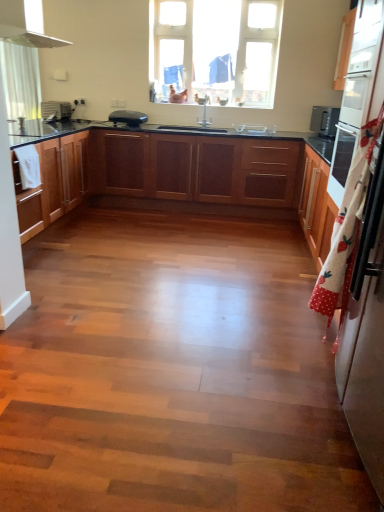
This screenshot has height=512, width=384. What do you see at coordinates (365, 355) in the screenshot? I see `white glossy refrigerator at right` at bounding box center [365, 355].

The image size is (384, 512). What do you see at coordinates (255, 129) in the screenshot? I see `white glossy sink at center` at bounding box center [255, 129].

Describe the element at coordinates (346, 229) in the screenshot. I see `white polka dot fabric at right` at that location.

What are the coordinates of `wooden cabinets at center, which is the third cabinetry in front-to-back order` in the screenshot? It's located at (194, 168).

The image size is (384, 512). What are the coordinates of `wooden cabinets at center, which ranks as the 1th cabinetry in front-to-back order` in the screenshot? It's located at (185, 175).

Which of these two, wooden cabinets at center, which ranks as the 1th cabinetry in front-to-back order, or white glossy sink at center, is smaller?

Smaller between the two is white glossy sink at center.

Which is correct: wooden cabinets at center, which ranks as the 1th cabinetry in front-to-back order, is inside white glossy sink at center, or outside of it?

wooden cabinets at center, which ranks as the 1th cabinetry in front-to-back order, is not enclosed by white glossy sink at center.

Locate an element on the screen. The height and width of the screenshot is (512, 384). sink on the right of wooden cabinets at center, the 3th cabinetry from the back is located at coordinates (255, 129).

How far apart are wooden cabinets at center, which is the 1th cabinetry from back to front, and transparent glass window at upper center?

wooden cabinets at center, which is the 1th cabinetry from back to front, and transparent glass window at upper center are 1.81 meters apart from each other.

Considering the sizes of objects wooden cabinets at center, which is the third cabinetry in front-to-back order, and transparent glass window at upper center in the image provided, who is smaller, wooden cabinets at center, which is the third cabinetry in front-to-back order, or transparent glass window at upper center?

With smaller size is transparent glass window at upper center.

Is wooden cabinets at center, which is the 1th cabinetry from back to front, inside or outside of transparent glass window at upper center?

wooden cabinets at center, which is the 1th cabinetry from back to front, lies outside transparent glass window at upper center.

How different are the orientations of wooden cabinets at center, which is the 1th cabinetry from back to front, and transparent glass window at upper center in degrees?

0.954 degrees.

Is black plastic toaster at upper center, the 2th appliance viewed from the left, outside of white glossy sink at center?

black plastic toaster at upper center, the 2th appliance viewed from the left, lies outside white glossy sink at center's area.

Which of these two, black plastic toaster at upper center, which ranks as the first appliance in right-to-left order, or white glossy sink at center, is thinner?

white glossy sink at center.

Is black plastic toaster at upper center, the 2th appliance viewed from the left, facing towards white glossy sink at center?

No, black plastic toaster at upper center, the 2th appliance viewed from the left, is not aimed at white glossy sink at center.

What's the angular difference between black plastic toaster at upper center, which ranks as the first appliance in right-to-left order, and white glossy sink at center's facing directions?

The angular difference between black plastic toaster at upper center, which ranks as the first appliance in right-to-left order, and white glossy sink at center is 0.973 degrees.

The width and height of the screenshot is (384, 512). What are the coordinates of `sink located on the right of transparent glass window at upper center` in the screenshot? It's located at (255, 129).

Who is bigger, white glossy sink at center or transparent glass window at upper center?

With larger size is transparent glass window at upper center.

Does white glossy sink at center come behind transparent glass window at upper center?

No, white glossy sink at center is closer to the viewer.

Is point (272, 132) closer or farther from the camera than point (237, 12)?

Clearly, point (272, 132) is more distant from the camera than point (237, 12).

Which of these two, white polka dot fabric at right or white glossy oven at right, stands shorter?

white glossy oven at right.

From the image's perspective, between white polka dot fabric at right and white glossy oven at right, which one is located above?

white glossy oven at right appears higher in the image.

The image size is (384, 512). What are the coordinates of `curtain lying on the left of white glossy oven at right` in the screenshot? It's located at (346, 229).

From the image's perspective, is white glossy refrigerator at right above white glossy exhaust hood at upper left?

No, from the image's perspective, white glossy refrigerator at right is not above white glossy exhaust hood at upper left.

The image size is (384, 512). I want to click on fridge below the white glossy exhaust hood at upper left (from a real-world perspective), so click(365, 355).

Considering the positions of objects white glossy refrigerator at right and white glossy exhaust hood at upper left in the image provided, who is more to the right, white glossy refrigerator at right or white glossy exhaust hood at upper left?

white glossy refrigerator at right is more to the right.

Does point (371, 334) appear closer or farther from the camera than point (31, 33)?

Point (371, 334).

Considering the sizes of objects black plastic toaster at upper center, which ranks as the first appliance in right-to-left order, and wooden cabinets at center, which is the 1th cabinetry from back to front, in the image provided, who is smaller, black plastic toaster at upper center, which ranks as the first appliance in right-to-left order, or wooden cabinets at center, which is the 1th cabinetry from back to front,?

black plastic toaster at upper center, which ranks as the first appliance in right-to-left order, is smaller.

From their relative heights in the image, would you say black plastic toaster at upper center, the 2th appliance viewed from the left, is taller or shorter than wooden cabinets at center, which is the 1th cabinetry from back to front?

black plastic toaster at upper center, the 2th appliance viewed from the left, is shorter than wooden cabinets at center, which is the 1th cabinetry from back to front.

Considering the sizes of objects black plastic toaster at upper center, the 2th appliance viewed from the left, and wooden cabinets at center, which is the 1th cabinetry from back to front, in the image provided, who is thinner, black plastic toaster at upper center, the 2th appliance viewed from the left, or wooden cabinets at center, which is the 1th cabinetry from back to front,?

With smaller width is black plastic toaster at upper center, the 2th appliance viewed from the left.

Where is `the 1st cabinetry directly beneath the white glossy sink at center (from a real-world perspective)`? the 1st cabinetry directly beneath the white glossy sink at center (from a real-world perspective) is located at coordinates (185, 175).

I want to click on cabinetry that is the 1st object located below the transparent glass window at upper center (from the image's perspective), so click(194, 168).

Estimate the real-world distances between objects in this image. Which object is further from white glossy exhaust hood at upper left, white glossy sink at center or wooden cabinets at left, acting as the second cabinetry starting from the front?

white glossy sink at center.

Considering their positions, is black plastic toaster at upper center, the 2th appliance viewed from the left, positioned closer to matte black toaster at left, marked as the 1th appliance in a left-to-right arrangement, than white glossy oven at right?

Based on the image, black plastic toaster at upper center, the 2th appliance viewed from the left, appears to be nearer to matte black toaster at left, marked as the 1th appliance in a left-to-right arrangement.

Considering their positions, is black plastic toaster at upper center, the 2th appliance viewed from the left, positioned closer to white glossy sink at center than transparent glass window at upper center?

transparent glass window at upper center.

Based on their spatial positions, is white glossy oven at right or white glossy sink at center closer to white glossy exhaust hood at upper left?

white glossy oven at right is positioned closer to the anchor white glossy exhaust hood at upper left.

Looking at the image, which one is located further to wooden cabinets at center, which is the 1th cabinetry from back to front, white glossy refrigerator at right or transparent glass window at upper center?

The object further to wooden cabinets at center, which is the 1th cabinetry from back to front, is white glossy refrigerator at right.

When comparing their distances from white glossy refrigerator at right, does white glossy sink at center or wooden cabinets at center, which is the 1th cabinetry from back to front, seem closer?

wooden cabinets at center, which is the 1th cabinetry from back to front.

Looking at the image, which one is located closer to black plastic toaster at upper center, the 2th appliance viewed from the left, wooden cabinets at center, which is the third cabinetry in front-to-back order, or white glossy oven at right?

Based on the image, wooden cabinets at center, which is the third cabinetry in front-to-back order, appears to be nearer to black plastic toaster at upper center, the 2th appliance viewed from the left.

Estimate the real-world distances between objects in this image. Which object is further from wooden cabinets at center, which is the third cabinetry in front-to-back order, white glossy oven at right or matte black toaster at left, which appears as the 2th appliance when viewed from the right?

white glossy oven at right is further to wooden cabinets at center, which is the third cabinetry in front-to-back order.

The width and height of the screenshot is (384, 512). I want to click on exhaust hood between wooden cabinets at left, acting as the 2th cabinetry starting from the back, and white glossy sink at center from left to right, so click(x=23, y=28).

This screenshot has width=384, height=512. What are the coordinates of `window between black plastic toaster at upper center, the 2th appliance viewed from the left, and white glossy sink at center from left to right` in the screenshot? It's located at (215, 50).

The width and height of the screenshot is (384, 512). I want to click on cabinetry located between wooden cabinets at left, acting as the second cabinetry starting from the front, and black plastic toaster at upper center, which ranks as the first appliance in right-to-left order, in the depth direction, so click(194, 168).

I want to click on oven located between white glossy refrigerator at right and matte black toaster at left, which appears as the 2th appliance when viewed from the right, in the depth direction, so click(x=357, y=86).